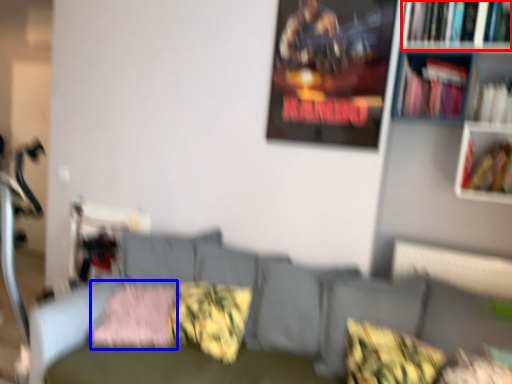
Question: Which of the following is the closest to the observer, book (highlighted by a red box) or pillow (highlighted by a blue box)?

Choices:
 (A) book
 (B) pillow

Answer: (A)